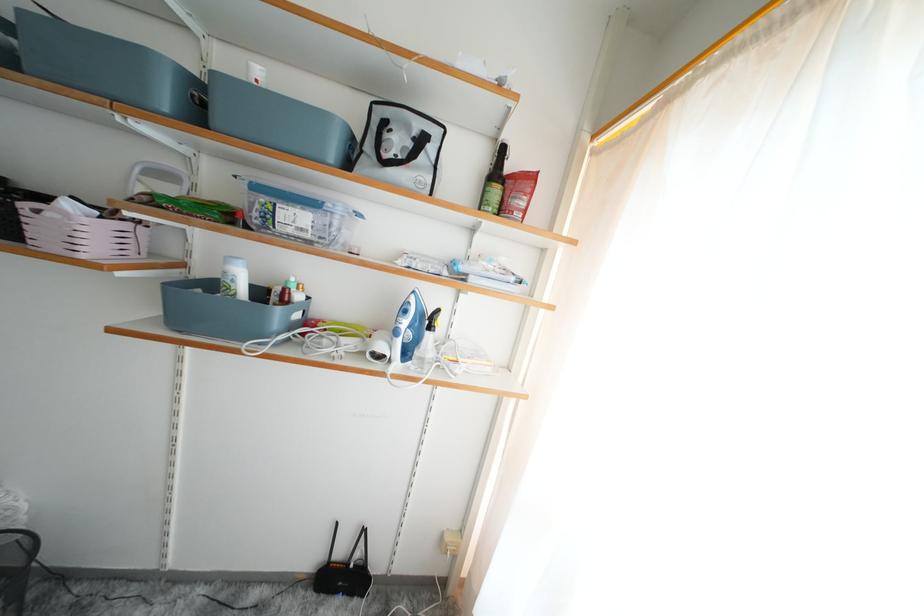
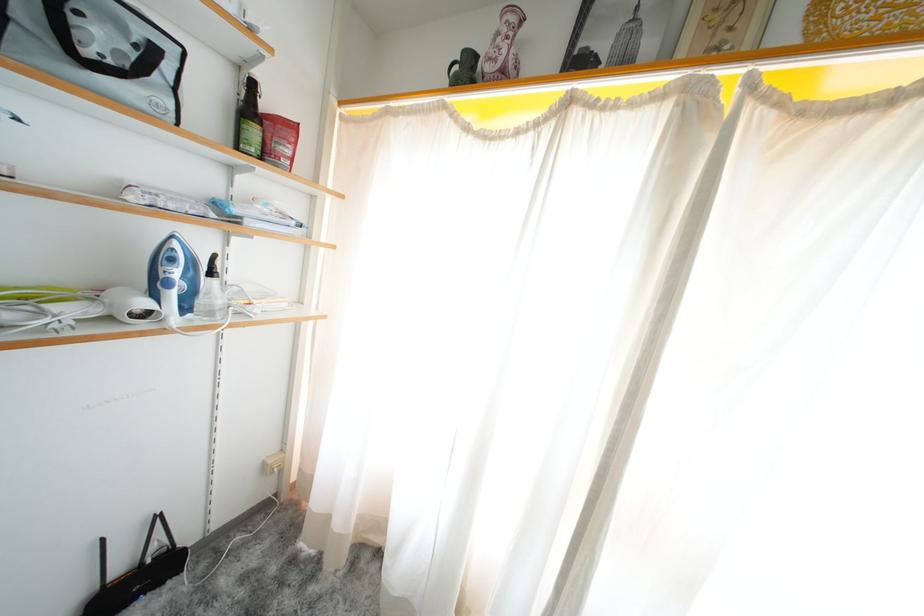
In the second image, find the point that corresponds to pixel 411 315 in the first image.

(178, 264)